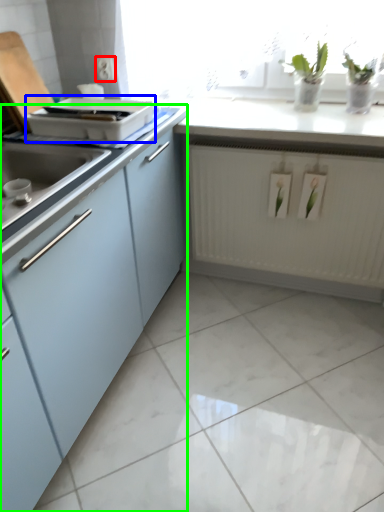
Question: Which object is positioned farthest from electric outlet (highlighted by a red box)? Select from appliance (highlighted by a blue box) and cabinetry (highlighted by a green box).

Choices:
 (A) appliance
 (B) cabinetry

Answer: (B)